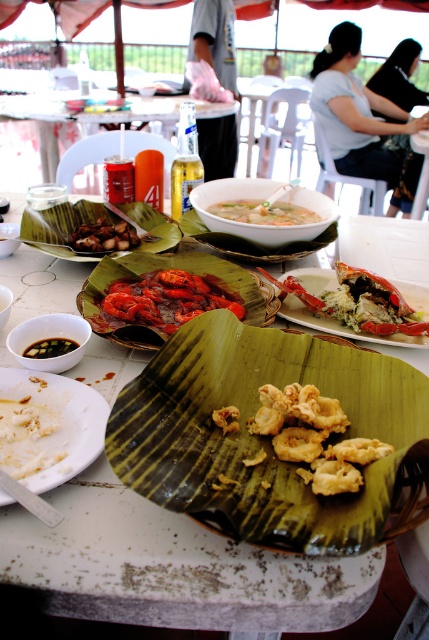
Identify the location of shiny red lobster at center. This screenshot has height=640, width=429. (341, 324).

Is point (296, 323) positioned before point (48, 352)?

No, it is behind (48, 352).

Image resolution: width=429 pixels, height=640 pixels. I want to click on shiny red lobster at center, so click(x=341, y=324).

Is point (417, 339) more distant than point (335, 237)?

That is False.

Describe the element at coordinates (341, 324) in the screenshot. The image size is (429, 640). I see `shiny red lobster at center` at that location.

Is point (296, 275) positioned behind point (301, 248)?

No, (296, 275) is in front of (301, 248).

Where is `shiny red lobster at center`? The height and width of the screenshot is (640, 429). shiny red lobster at center is located at coordinates (341, 324).

How much distance is there between green leafy banana leaf at center and brown matte fried food at center?

green leafy banana leaf at center and brown matte fried food at center are 18.49 inches apart.

Between green leafy banana leaf at center and brown matte fried food at center, which one is positioned lower?

green leafy banana leaf at center is below.

Identify the location of green leafy banana leaf at center. (268, 436).